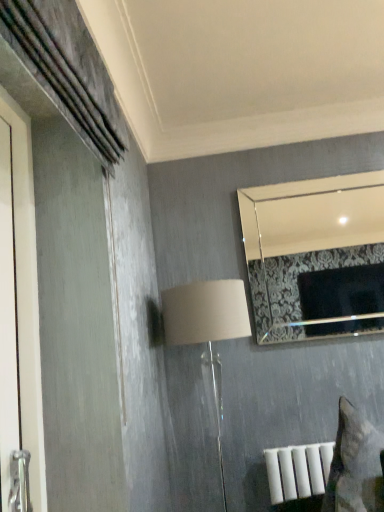
Question: Considering the positions of silver metallic mirror at upper right and beige fabric lampshade at center in the image, is silver metallic mirror at upper right taller or shorter than beige fabric lampshade at center?

Choices:
 (A) short
 (B) tall

Answer: (A)

Question: Considering the positions of point (284, 301) and point (225, 303), is point (284, 301) closer or farther from the camera than point (225, 303)?

Choices:
 (A) closer
 (B) farther

Answer: (B)

Question: Is silver metallic mirror at upper right inside or outside of beige fabric lampshade at center?

Choices:
 (A) inside
 (B) outside

Answer: (B)

Question: Would you say beige fabric lampshade at center is to the left or to the right of silver metallic mirror at upper right in the picture?

Choices:
 (A) left
 (B) right

Answer: (A)

Question: Based on their sizes in the image, would you say beige fabric lampshade at center is bigger or smaller than silver metallic mirror at upper right?

Choices:
 (A) small
 (B) big

Answer: (B)

Question: From the image's perspective, is beige fabric lampshade at center above or below silver metallic mirror at upper right?

Choices:
 (A) above
 (B) below

Answer: (B)

Question: Looking at their shapes, would you say beige fabric lampshade at center is wider or thinner than silver metallic mirror at upper right?

Choices:
 (A) wide
 (B) thin

Answer: (A)